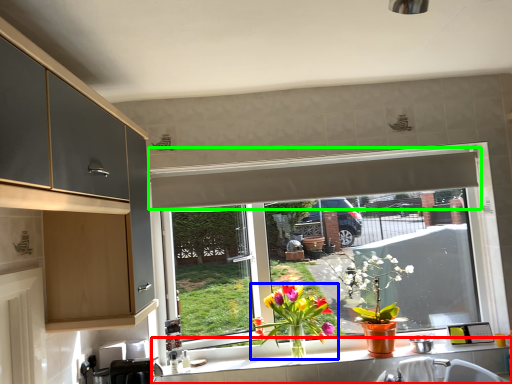
Question: Considering the real-world distances, which object is farthest from countertop (highlighted by a red box)? houseplant (highlighted by a blue box) or exhaust hood (highlighted by a green box)?

Choices:
 (A) houseplant
 (B) exhaust hood

Answer: (B)